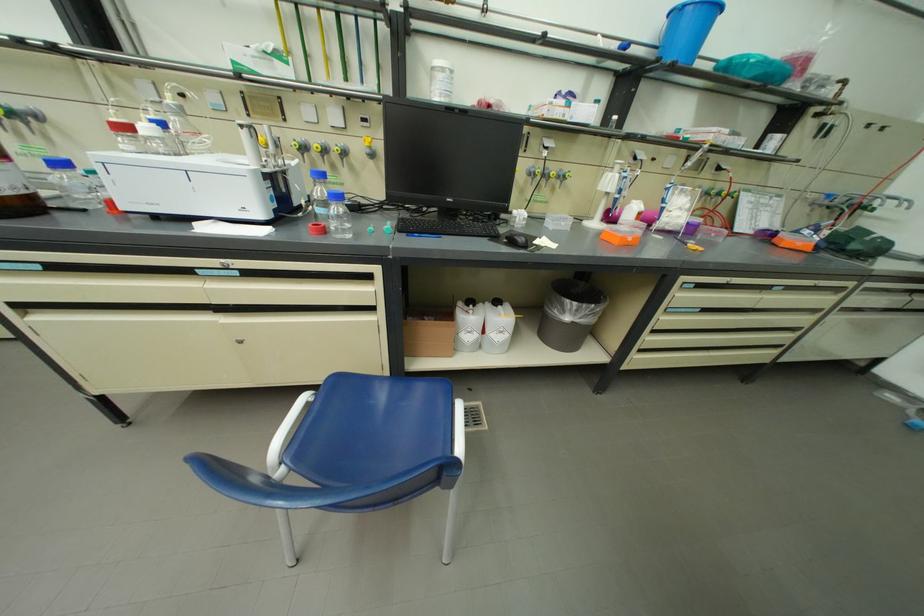
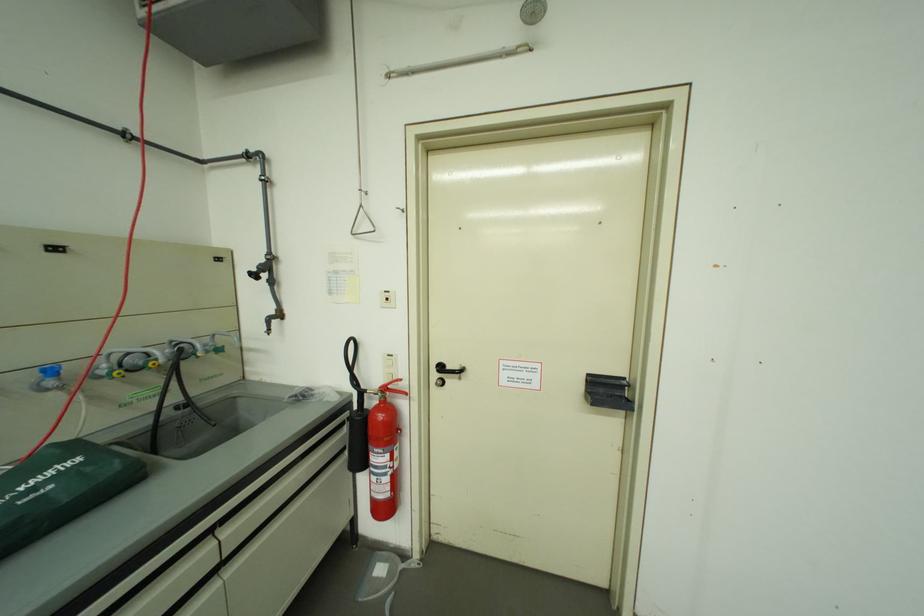
In the second image, find the point that corresponds to [839,198] in the first image.

(62, 373)